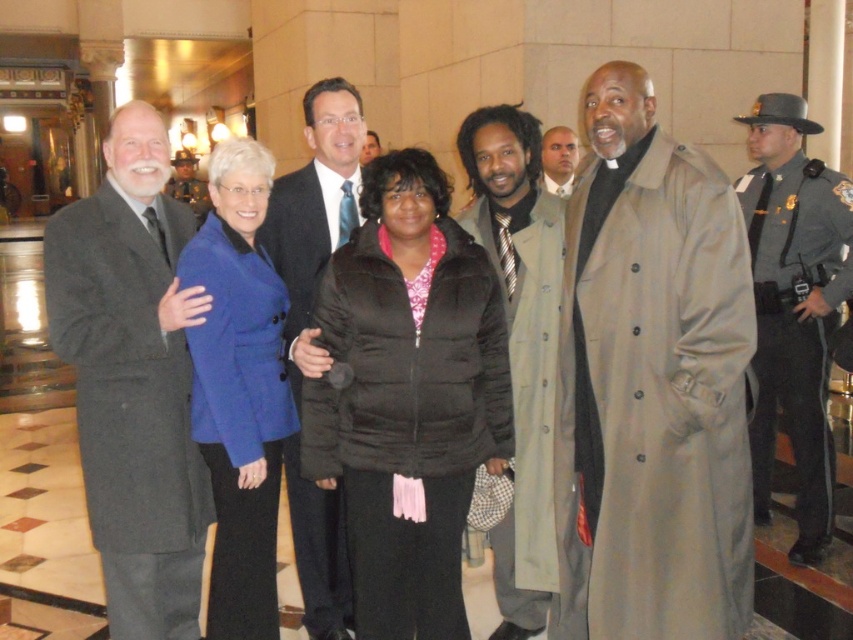
Can you confirm if matte black suit at left is shorter than shiny blue suit at center?

Correct, matte black suit at left is not as tall as shiny blue suit at center.

Which is in front, point (73, 272) or point (350, 586)?

Point (73, 272)

Does point (74, 248) lie behind point (347, 93)?

No, it is in front of (347, 93).

Where is `matte black suit at left`? Image resolution: width=853 pixels, height=640 pixels. matte black suit at left is located at coordinates (132, 380).

Consider the image. Between gray uniformed officer at right and shiny blue suit at center, which one has more height?

Standing taller between the two is shiny blue suit at center.

Is gray uniformed officer at right smaller than shiny blue suit at center?

No, gray uniformed officer at right is not smaller than shiny blue suit at center.

The image size is (853, 640). What do you see at coordinates (793, 305) in the screenshot?
I see `gray uniformed officer at right` at bounding box center [793, 305].

Find the location of `gray uniformed officer at right`. gray uniformed officer at right is located at coordinates (793, 305).

This screenshot has height=640, width=853. I want to click on matte black suit at left, so click(132, 380).

Does matte black suit at left appear over light brown textured coat at center?

Incorrect, matte black suit at left is not positioned above light brown textured coat at center.

Which is in front, point (114, 461) or point (476, 168)?

Point (114, 461)

You are a GUI agent. You are given a task and a screenshot of the screen. Output one action in this format:
    pyautogui.click(x=<x>, y=<y>)
    Task: Click on the matte black suit at left
    The height and width of the screenshot is (640, 853).
    Given the screenshot: What is the action you would take?
    pyautogui.click(x=132, y=380)